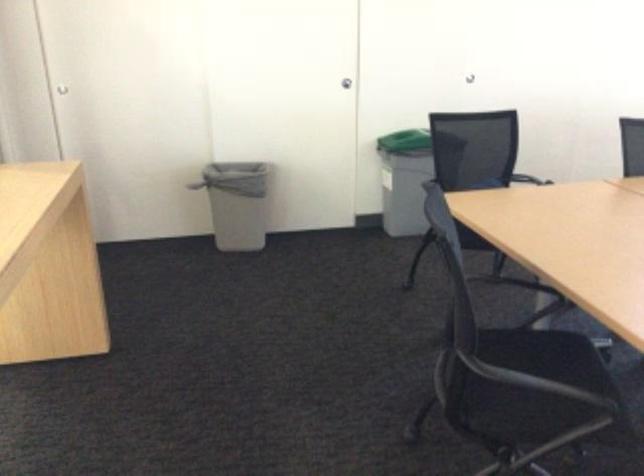
The location [236,203] corresponds to which object?

This point indicates the gray trash can.